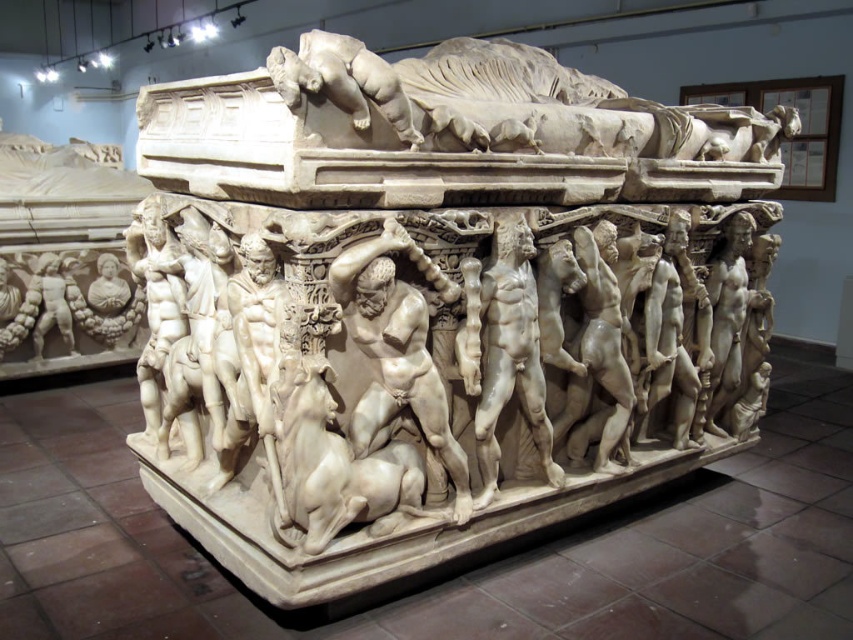
You are a museum curator planning to install a new exhibit. You need to place a 2.5 meter tall statue in the center of the room. The white marble sarcophagus at upper center and the white marble man at center are already present. Which object should you consider moving to accommodate the new statue?

The white marble sarcophagus at upper center is shorter than the white marble man at center, so moving the taller white marble man at center would provide more space for the new 2.5 meter tall statue.

You are an art student observing the sarcophagus in the museum. You notice two figures on it. Which figure is bigger between the white marble muscular man at center and the smooth white figure at lower left?

The white marble muscular man at center is larger in size than the smooth white figure at lower left.

You are a museum curator planning to move the white marble man at center and the smooth white figure at lower left to a new exhibition space. The new space has a limited height clearance of 2 meters. Can both objects be moved without any adjustments?

The white marble man at center is larger in size than the smooth white figure at lower left. However, without specific height measurements provided, it is impossible to determine if their sizes exceed the 2 meters height clearance. Additional information about their exact dimensions is required to answer this question accurately.